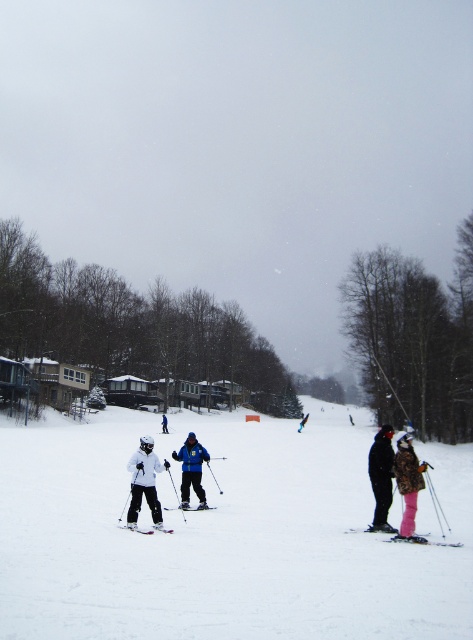
You are a photographer trying to capture a photo of the blue matte jacket at center and the shiny blue snowboard at center. Which object should you focus on first if you want to ensure both are in sharp focus?

The blue matte jacket at center is located above the shiny blue snowboard at center, so you should focus on the blue matte jacket at center first to ensure both are in sharp focus.

You are a photographer trying to capture a clear photo of the white matte jacket at center. However, the white matte snow at center is in front of it. Will the jacket be visible in your photo?

The white matte snow at center is in front of the white matte jacket at center, so the snow may obscure the jacket in the photo, making it less visible.